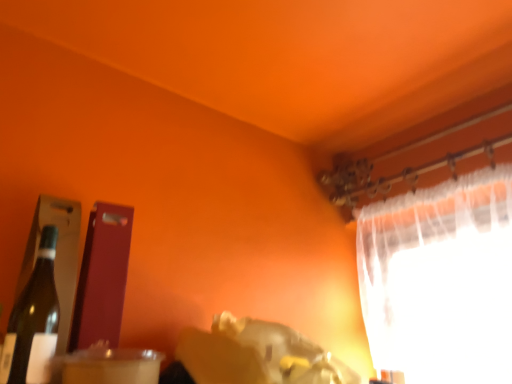
Question: Is matte glass bottle at left turned away from white sheer curtain at upper right?

Choices:
 (A) no
 (B) yes

Answer: (A)

Question: Is matte glass bottle at left facing towards white sheer curtain at upper right?

Choices:
 (A) yes
 (B) no

Answer: (B)

Question: From a real-world perspective, is matte glass bottle at left over white sheer curtain at upper right?

Choices:
 (A) yes
 (B) no

Answer: (B)

Question: Is matte glass bottle at left shorter than white sheer curtain at upper right?

Choices:
 (A) yes
 (B) no

Answer: (A)

Question: Does matte glass bottle at left appear on the right side of white sheer curtain at upper right?

Choices:
 (A) yes
 (B) no

Answer: (B)

Question: Is white sheer curtain at upper right completely or partially inside matte glass bottle at left?

Choices:
 (A) yes
 (B) no

Answer: (B)

Question: From a real-world perspective, is clear plastic straw at lower left positioned over white sheer curtain at upper right based on gravity?

Choices:
 (A) yes
 (B) no

Answer: (B)

Question: Is clear plastic straw at lower left turned away from white sheer curtain at upper right?

Choices:
 (A) yes
 (B) no

Answer: (B)

Question: Does clear plastic straw at lower left have a smaller size compared to white sheer curtain at upper right?

Choices:
 (A) yes
 (B) no

Answer: (A)

Question: Is clear plastic straw at lower left behind white sheer curtain at upper right?

Choices:
 (A) yes
 (B) no

Answer: (B)

Question: Can you confirm if clear plastic straw at lower left is shorter than white sheer curtain at upper right?

Choices:
 (A) yes
 (B) no

Answer: (A)

Question: Is clear plastic straw at lower left outside white sheer curtain at upper right?

Choices:
 (A) no
 (B) yes

Answer: (B)

Question: Does clear plastic straw at lower left turn towards matte glass bottle at left?

Choices:
 (A) no
 (B) yes

Answer: (A)